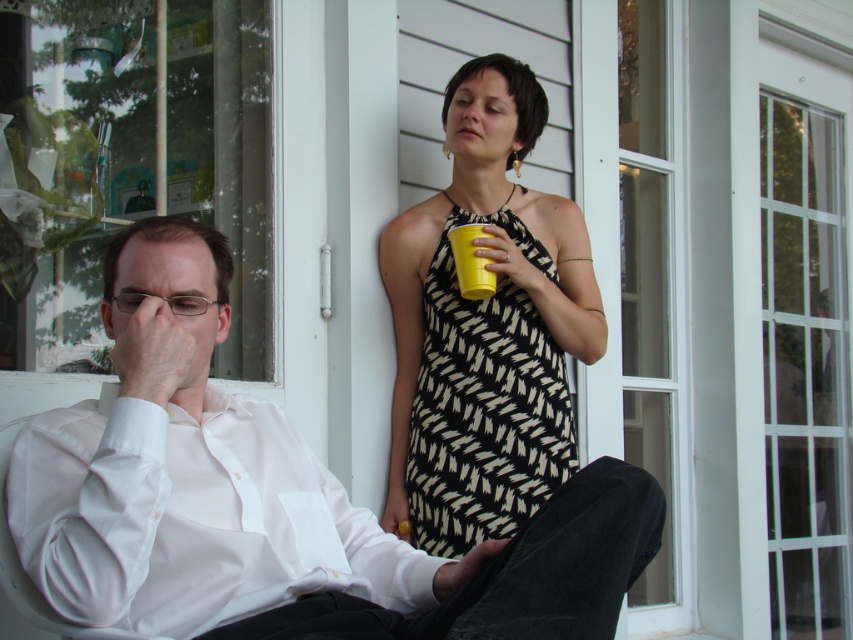
The image size is (853, 640). I want to click on white cotton shirt at left, so click(x=273, y=500).

I want to click on white cotton shirt at left, so click(273, 500).

Does white smooth shirt at left have a smaller size compared to black and white zigzag dress at upper center?

No, white smooth shirt at left is not smaller than black and white zigzag dress at upper center.

The image size is (853, 640). What do you see at coordinates (190, 516) in the screenshot? I see `white smooth shirt at left` at bounding box center [190, 516].

Which is behind, point (35, 480) or point (457, 349)?

Positioned behind is point (457, 349).

Identify the location of white smooth shirt at left. Image resolution: width=853 pixels, height=640 pixels. (190, 516).

Between point (181, 588) and point (450, 488), which one is positioned in front?

Point (181, 588) is more forward.

Which is below, white cotton shirt at left or black and white zigzag dress at upper center?

white cotton shirt at left is lower down.

You are a GUI agent. You are given a task and a screenshot of the screen. Output one action in this format:
    pyautogui.click(x=<x>, y=<y>)
    Task: Click on the white cotton shirt at left
    
    Given the screenshot: What is the action you would take?
    pyautogui.click(x=273, y=500)